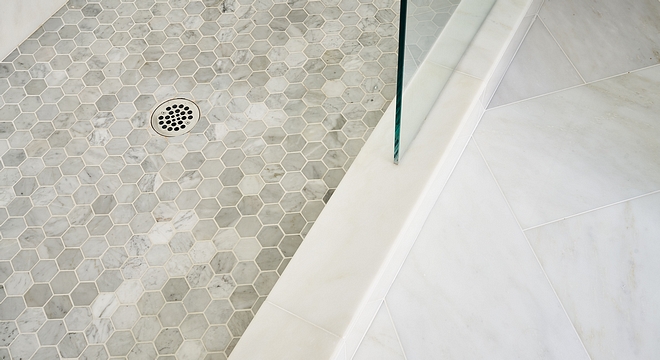
This screenshot has height=360, width=660. Identify the location of hex marble floor. (189, 206).